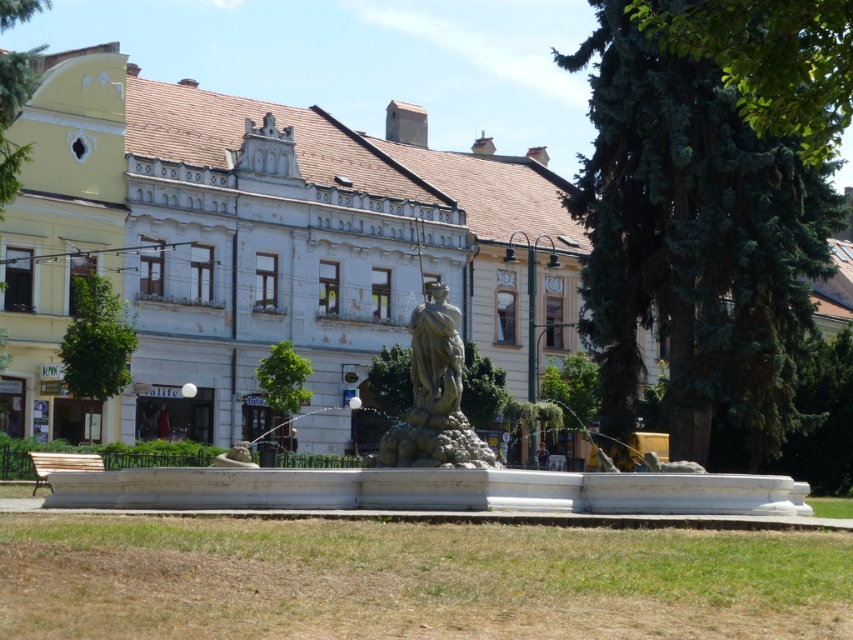
Looking at this image, does bronze statue at center have a smaller size compared to green leafy tree at upper left?

No.

Between point (438, 422) and point (16, 3), which one is positioned behind?

The point (16, 3) is behind.

You are a GUI agent. You are given a task and a screenshot of the screen. Output one action in this format:
    pyautogui.click(x=<x>, y=<y>)
    Task: Click on the bronze statue at center
    
    Given the screenshot: What is the action you would take?
    pyautogui.click(x=434, y=396)

Locate an element on the screen. white marble fountain at center is located at coordinates (427, 468).

Does white marble fountain at center appear on the right side of bronze statue at center?

Indeed, white marble fountain at center is positioned on the right side of bronze statue at center.

Locate an element on the screen. white marble fountain at center is located at coordinates (427, 468).

Who is taller, white marble fountain at center or green leafy tree at upper left?

green leafy tree at upper left

What are the coordinates of `white marble fountain at center` in the screenshot? It's located at (427, 468).